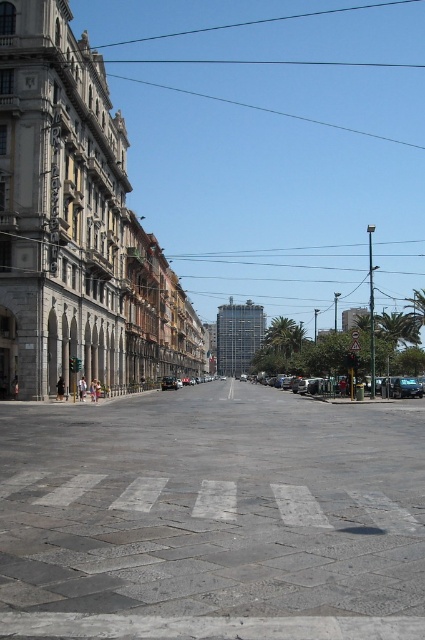
Who is taller, gray concrete plaza at center or metallic silver car at center?

Standing taller between the two is gray concrete plaza at center.

Does point (405, 445) lie behind point (166, 381)?

No, (405, 445) is in front of (166, 381).

What do you see at coordinates (212, 516) in the screenshot?
I see `gray concrete plaza at center` at bounding box center [212, 516].

This screenshot has height=640, width=425. I want to click on gray concrete plaza at center, so click(212, 516).

Between point (413, 387) and point (353, 372), which one is positioned behind?

The point (413, 387) is more distant.

Is metallic silver car at right to the left of metallic reflective sign at center from the viewer's perspective?

In fact, metallic silver car at right is to the right of metallic reflective sign at center.

At what (x,y) coordinates should I click in order to perform the action: click on metallic silver car at right. Please return your answer as a coordinate pair (x, y). This screenshot has height=640, width=425. Looking at the image, I should click on (405, 387).

Is point (353, 371) behind point (170, 380)?

No, (353, 371) is closer to viewer.

Which is more to the left, metallic reflective sign at center or metallic silver car at center?

Positioned to the left is metallic silver car at center.

In order to click on metallic reflective sign at center in this screenshot , I will do `click(353, 362)`.